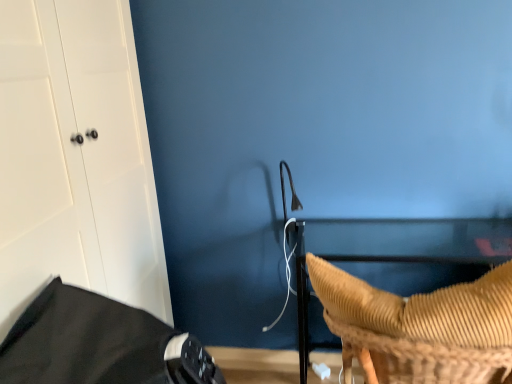
What do you see at coordinates (421, 327) in the screenshot? The height and width of the screenshot is (384, 512). I see `woven wood chair at lower right` at bounding box center [421, 327].

You are a GUI agent. You are given a task and a screenshot of the screen. Output one action in this format:
    pyautogui.click(x=<x>, y=<y>)
    Task: Click on the woven wood chair at lower right
    This screenshot has width=512, height=384.
    Given the screenshot: What is the action you would take?
    pyautogui.click(x=421, y=327)

The image size is (512, 384). In order to click on woven wood chair at lower right in this screenshot , I will do `click(421, 327)`.